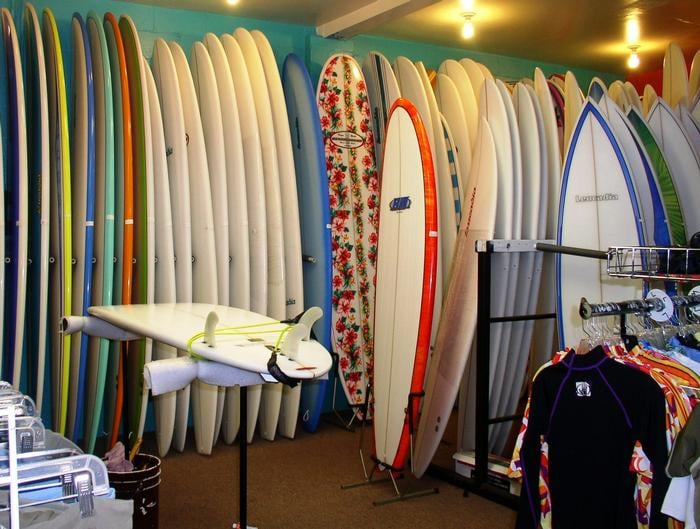
The width and height of the screenshot is (700, 529). What are the coordinates of `ceiling` in the screenshot? It's located at (539, 30).